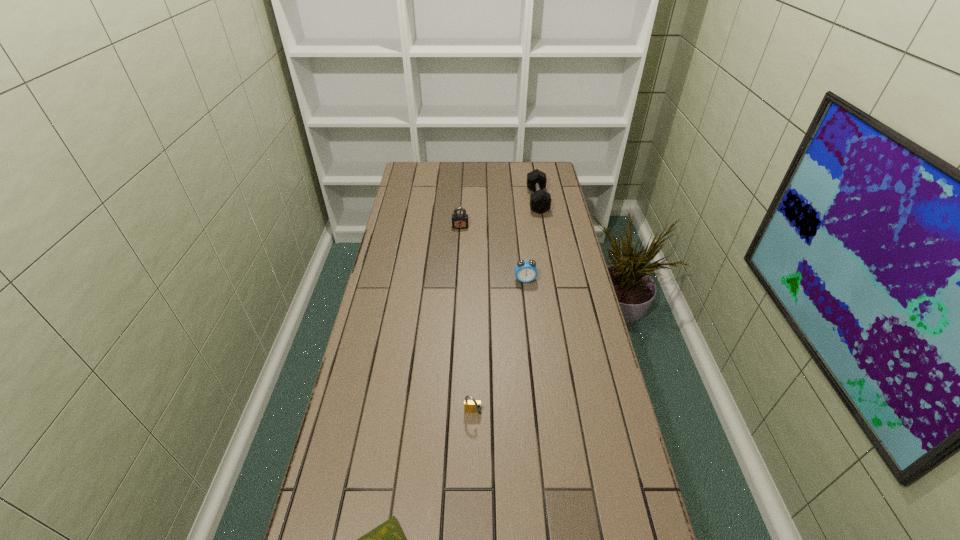
This screenshot has width=960, height=540. I want to click on the farthest object, so click(x=540, y=201).

This screenshot has width=960, height=540. I want to click on the rightmost object, so click(x=540, y=201).

The width and height of the screenshot is (960, 540). In order to click on the second farthest object in this screenshot , I will do `click(459, 221)`.

Find the location of a particular element. the farther padlock is located at coordinates (459, 221).

You are a GUI agent. You are given a task and a screenshot of the screen. Output one action in this format:
    pyautogui.click(x=<x>, y=<y>)
    Task: Click on the third nearest object
    The image size is (960, 540).
    Given the screenshot: What is the action you would take?
    pyautogui.click(x=525, y=271)

Locate an element on the screen. The height and width of the screenshot is (540, 960). alarm clock is located at coordinates (525, 271).

Locate an element on the screen. the right padlock is located at coordinates (470, 406).

The image size is (960, 540). I want to click on the nearer padlock, so (470, 406).

Where is `vacant region located 0.070m on the left of the dumbbell`? This screenshot has width=960, height=540. vacant region located 0.070m on the left of the dumbbell is located at coordinates (513, 200).

You are a GUI agent. You are given a task and a screenshot of the screen. Output one action in this format:
    pyautogui.click(x=<x>, y=<y>)
    Task: Click on the free region located 0.150m on the front of the taller padlock near the keyhole
    This screenshot has width=960, height=540.
    Given the screenshot: What is the action you would take?
    pyautogui.click(x=459, y=252)